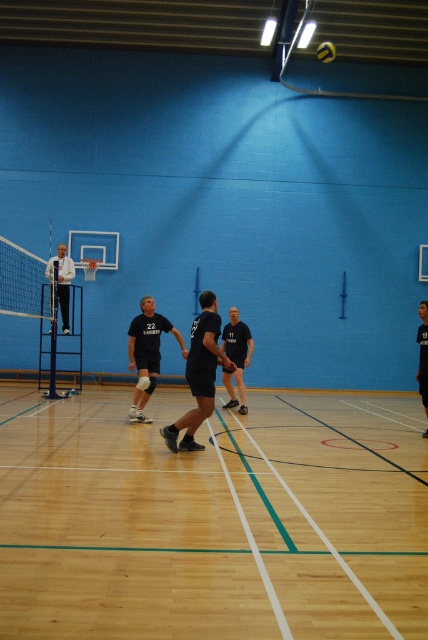
Question: Estimate the real-world distances between objects in this image. Which object is farther from the yellow matte volleyball at center?

Choices:
 (A) black matte jersey at center
 (B) black matte/vinyl shorts at center
 (C) wooden floor at center
 (D) white matte jacket at left

Answer: (C)

Question: Is wooden floor at center smaller than black matte shirt at center?

Choices:
 (A) yes
 (B) no

Answer: (B)

Question: Is black matte jersey at center thinner than black matte/vinyl shorts at center?

Choices:
 (A) yes
 (B) no

Answer: (A)

Question: Which point is closer to the camera taking this photo?

Choices:
 (A) (82, 468)
 (B) (142, 364)

Answer: (A)

Question: Which point is farther to the camera?

Choices:
 (A) dark blue jersey at center
 (B) white matte jacket at left

Answer: (B)

Question: Is black matte shirt at center above dark blue jersey at center?

Choices:
 (A) yes
 (B) no

Answer: (A)